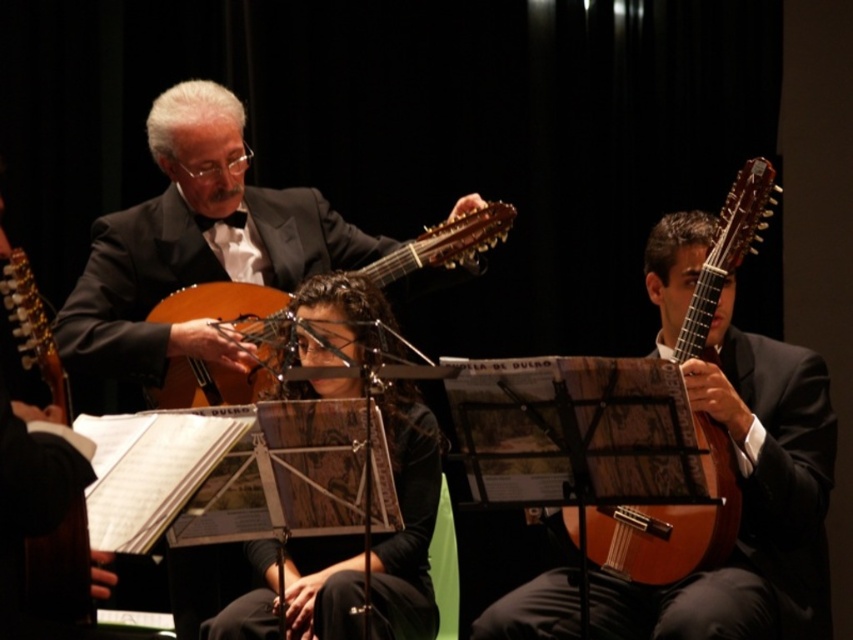
Which is behind, point (281, 202) or point (727, 531)?

Point (281, 202)

Is point (223, 369) less distant than point (596, 540)?

That is False.

Locate an element on the screen. shiny black suit at center is located at coordinates (196, 246).

Between point (119, 305) and point (199, 385), which one is positioned behind?

The point (119, 305) is more distant.

Does point (119, 221) come closer to viewer compared to point (194, 397)?

No, (119, 221) is behind (194, 397).

Identify the location of shiny black suit at center. (196, 246).

Can you confirm if wooden acoustic guitar at right is thinner than wooden acoustic guitar at center?

Incorrect, wooden acoustic guitar at right's width is not less than wooden acoustic guitar at center's.

Is wooden acoustic guitar at right to the left of wooden acoustic guitar at center from the viewer's perspective?

No, wooden acoustic guitar at right is not to the left of wooden acoustic guitar at center.

What do you see at coordinates (666, 522) in the screenshot? This screenshot has height=640, width=853. I see `wooden acoustic guitar at right` at bounding box center [666, 522].

What are the coordinates of `wooden acoustic guitar at right` in the screenshot? It's located at (666, 522).